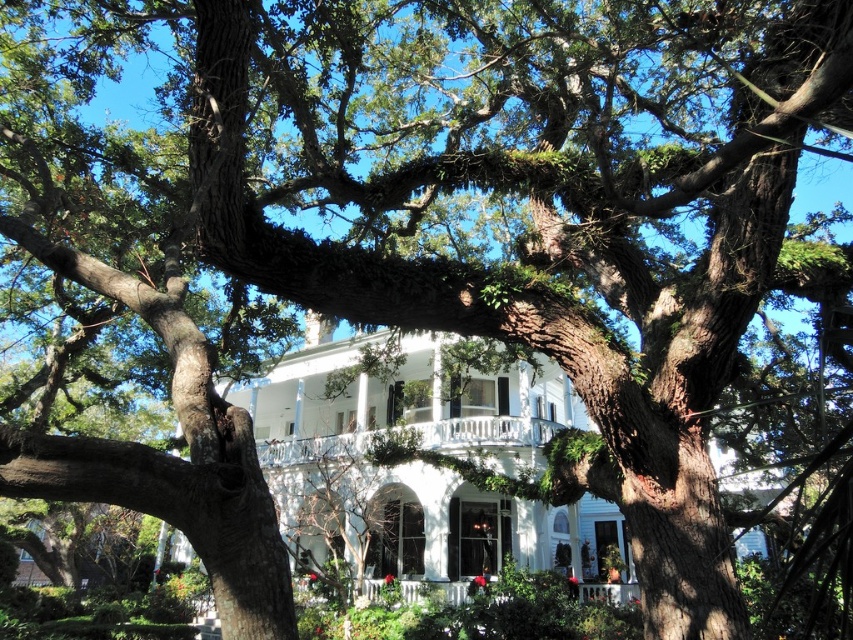
Question: Considering the relative positions of white painted wood porch at center and white wooden porch at center in the image provided, where is white painted wood porch at center located with respect to white wooden porch at center?

Choices:
 (A) left
 (B) right

Answer: (A)

Question: Which of the following is the farthest from the observer?

Choices:
 (A) white glossy mansion at center
 (B) white wooden porch at center
 (C) white painted wood porch at center

Answer: (B)

Question: Among these objects, which one is farthest from the camera?

Choices:
 (A) white glossy mansion at center
 (B) white wooden porch at center

Answer: (B)

Question: Which object is the farthest from the white wooden porch at center?

Choices:
 (A) white painted wood porch at center
 (B) white glossy mansion at center

Answer: (B)

Question: Does white painted wood porch at center come in front of white wooden porch at center?

Choices:
 (A) no
 (B) yes

Answer: (B)

Question: Considering the relative positions of white painted wood porch at center and white wooden porch at center in the image provided, where is white painted wood porch at center located with respect to white wooden porch at center?

Choices:
 (A) left
 (B) right

Answer: (A)